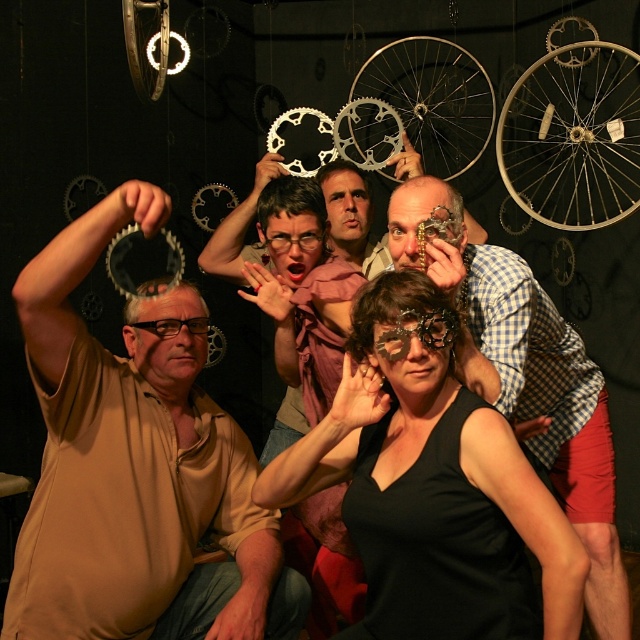
You are a photographer setting up for a group photo. You have a matte gold shirt at center and a smooth skin face at center in your frame. Based on their sizes, which one would block the other from being fully visible if they are positioned directly in front?

The matte gold shirt at center is wider than the smooth skin face at center, so if positioned directly in front, the matte gold shirt at center would block parts of the smooth skin face at center from being fully visible.

From the picture: You are directing a play and need to position the spotlight on the matte gold shirt at center and the matte brown head at center. Since the spotlight can only focus on one object at a time, which one should you aim it at first if you want to follow the left to right stage direction?

The matte gold shirt at center is to the left of the matte brown head at center, so you should aim the spotlight at the matte gold shirt at center first to follow the left to right stage direction.